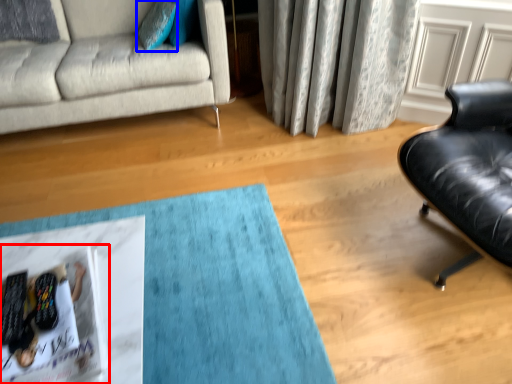
Question: Which object is further to the camera taking this photo, magazine (highlighted by a red box) or pillow (highlighted by a blue box)?

Choices:
 (A) magazine
 (B) pillow

Answer: (B)